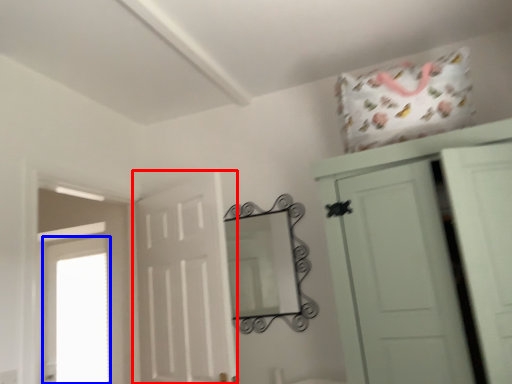
Question: Among these objects, which one is farthest to the camera, door (highlighted by a red box) or window (highlighted by a blue box)?

Choices:
 (A) door
 (B) window

Answer: (B)